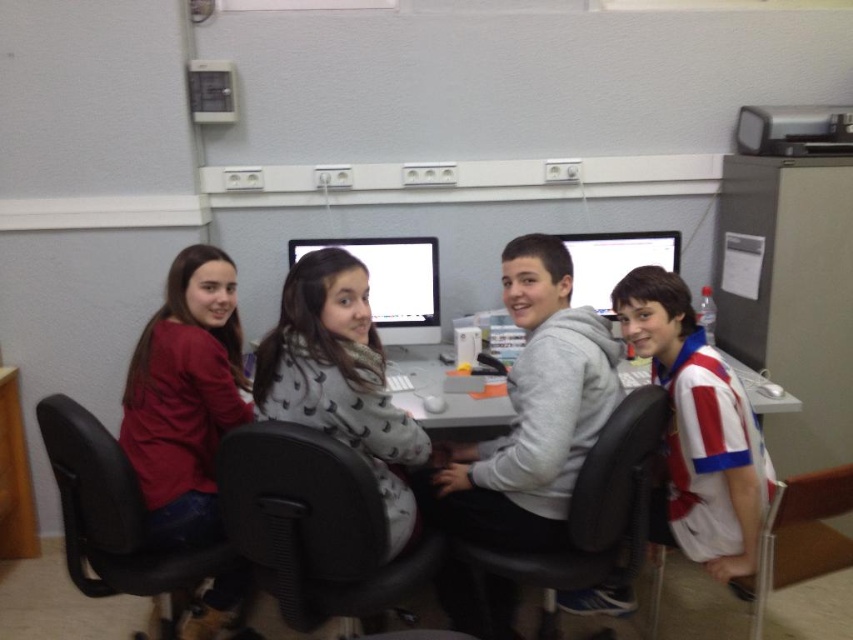
Question: Does gray matte hoodie at center come in front of matte red shirt at left?

Choices:
 (A) yes
 (B) no

Answer: (A)

Question: Estimate the real-world distances between objects in this image. Which object is closer to the black plastic chair at center?

Choices:
 (A) matte red shirt at left
 (B) black leather swivel chair at center

Answer: (B)

Question: Can you confirm if black plastic chair at lower right is smaller than matte white monitor at center?

Choices:
 (A) no
 (B) yes

Answer: (A)

Question: Does gray matte hoodie at center appear on the left side of black leather swivel chair at center?

Choices:
 (A) yes
 (B) no

Answer: (B)

Question: Which is nearer to the black leather swivel chair at left?

Choices:
 (A) gray matte hoodie at center
 (B) black plastic chair at center
 (C) matte red shirt at left

Answer: (C)

Question: Estimate the real-world distances between objects in this image. Which object is farther from the black leather swivel chair at left?

Choices:
 (A) black leather swivel chair at center
 (B) black plastic chair at lower right
 (C) matte plastic monitor at center

Answer: (B)